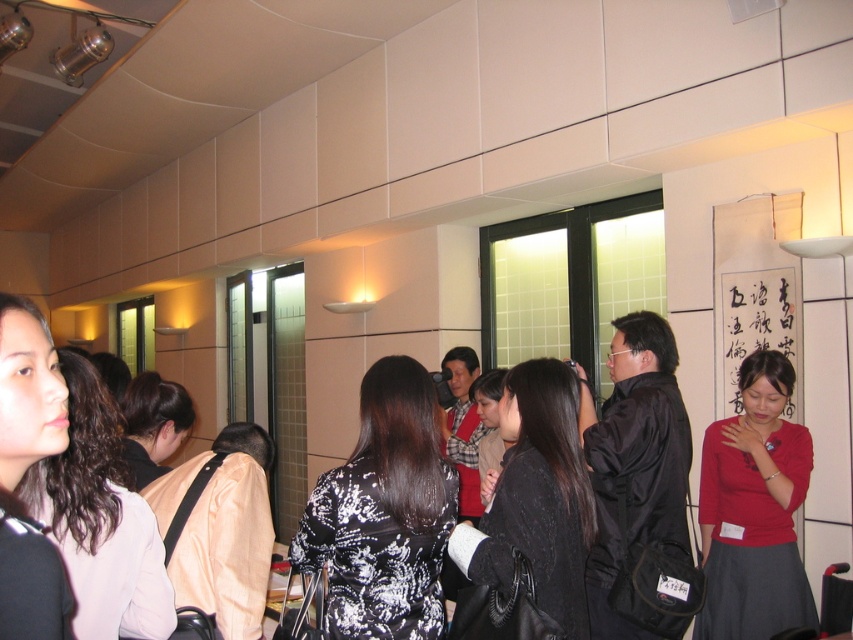
You are a photographer at the event and want to capture a photo of both the black printed dress at center and the black textured hair at center. Which object should you focus on first to ensure both are in the frame?

You should focus on the black textured hair at center first because the black printed dress at center is positioned to its right, ensuring both will be captured if you center the hair in your frame.

You are a photographer standing at the camera position in the image. You want to capture a closeup shot of the red matte dress at lower right. Given that your camera can focus on subjects within 10 feet, will you be able to take the closeup shot without moving closer?

The red matte dress at lower right is 9.07 feet away from the camera. Since the camera can focus within 10 feet, you can take the closeup shot without moving closer.

You are organizing a photoshoot and need to position two models wearing the black printed dress at center and the black textured sweater at center. Given that the minimum distance required between models for proper framing is 20 centimeters, can the current spacing between them be maintained?

The black printed dress at center and black textured sweater at center are 23.43 centimeters apart, which exceeds the minimum required distance of 20 centimeters. Therefore, the current spacing can be maintained as it meets the framing requirement.